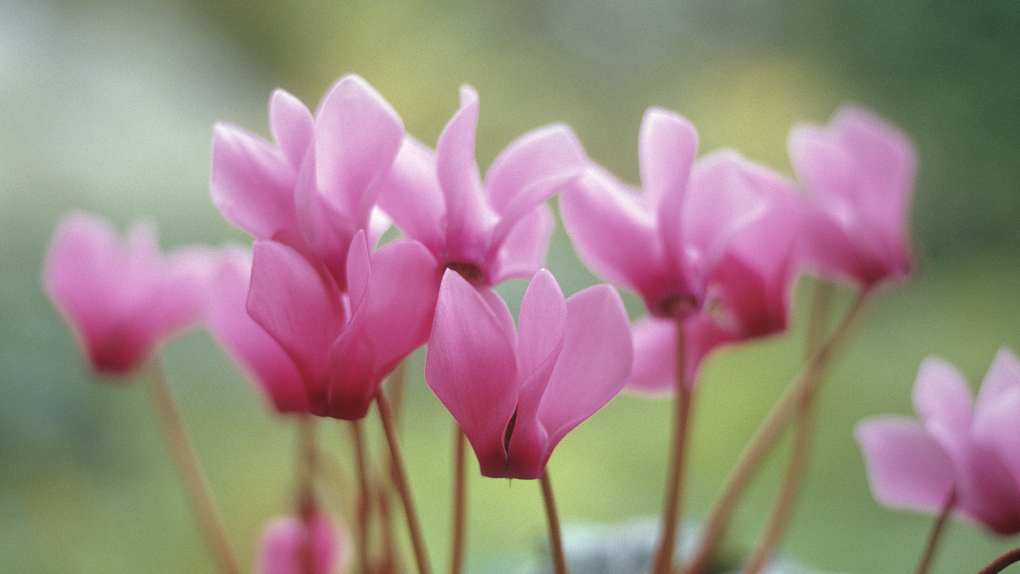
The image size is (1020, 574). I want to click on pink flowers, so click(x=972, y=453), click(x=838, y=184), click(x=772, y=247), click(x=671, y=245), click(x=492, y=436), click(x=311, y=352), click(x=481, y=211), click(x=316, y=168), click(x=128, y=293), click(x=276, y=545).